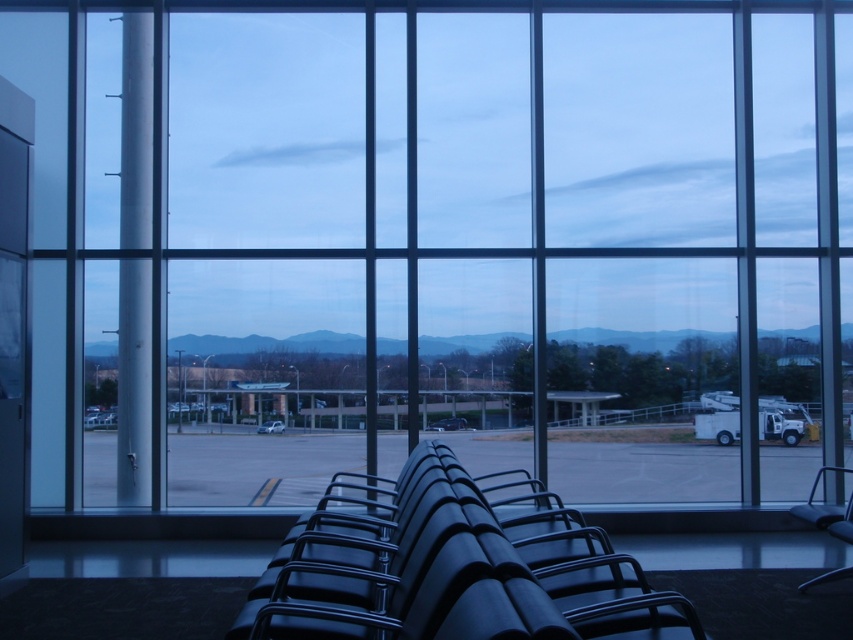
You are standing in the airport waiting area and want to take a photo through the large windows. You notice two points marked in the image. Which point, point (590, 609) or point (234, 458), will appear larger in your photo?

Point (590, 609) will appear larger in the photo because it is closer to the camera than point (234, 458).

You are a flight attendant carrying a large luggage cart that is 2 meters wide. You need to navigate through the airport terminal shown in the image. Can you pass between the matte black chair at center and the smooth concrete runway at center without hitting the cart?

The matte black chair at center might be wider than the smooth concrete runway at center, so there is uncertainty about whether the 2 meter wide cart can pass through safely. It is recommended to check the exact width difference before proceeding.